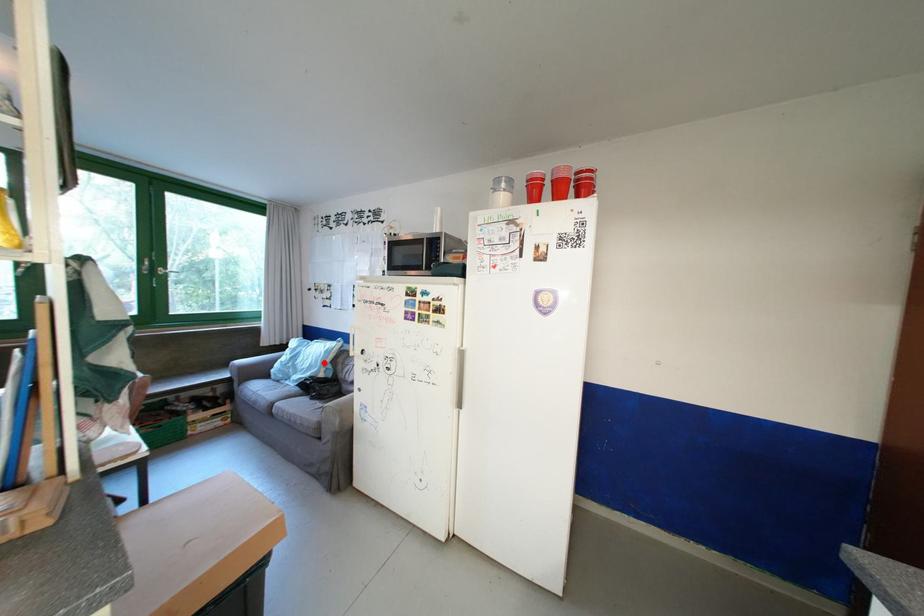
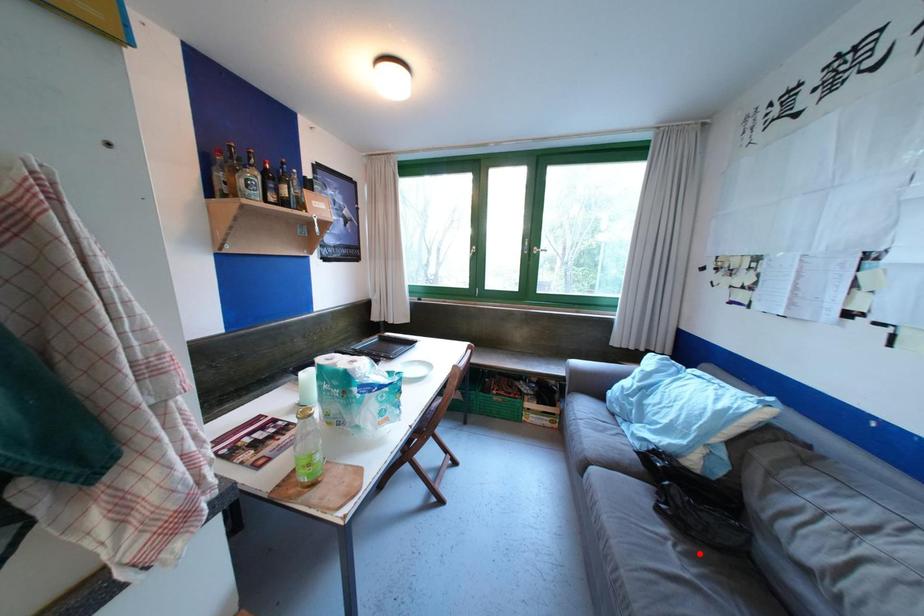
I am providing you with two images of the same scene from different viewpoints. A red point is marked on the first image and another point is marked on the second image. Are the points marked in image1 and image2 representing the same 3D position?

No